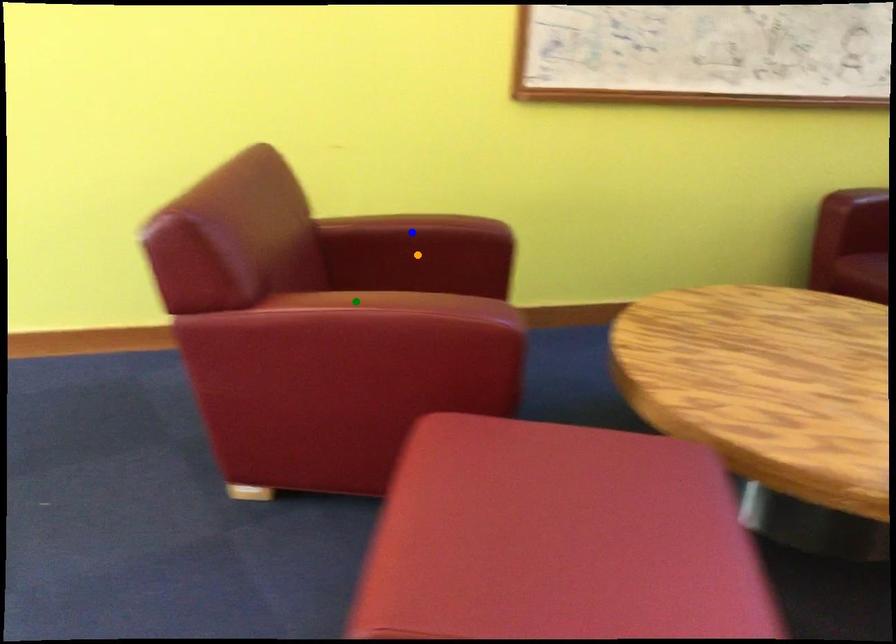
Order these from nearest to farthest:
blue point, green point, orange point

orange point < blue point < green point